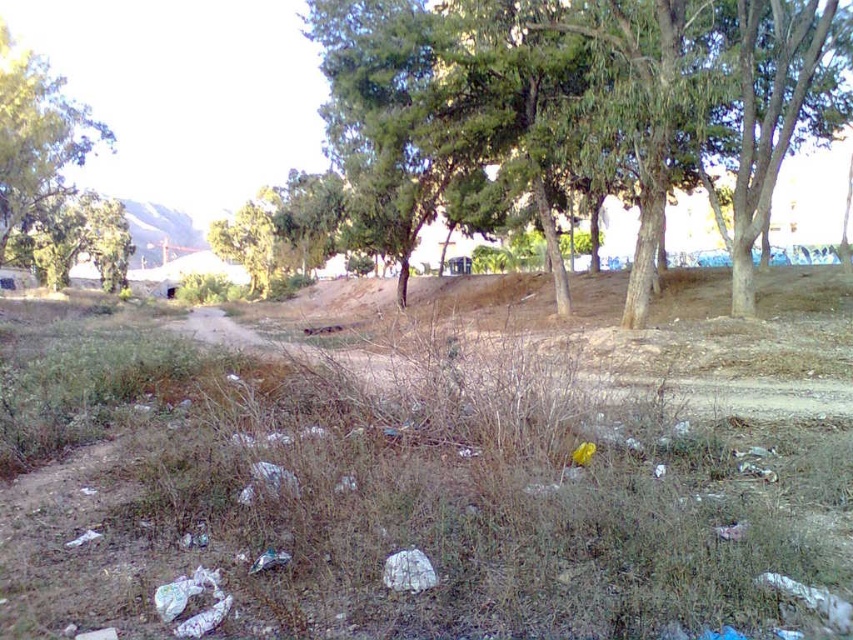
You are planning to set up a picnic area in the park. The picnic area requires a space wider than the green leafy tree at upper left. Can the brown grassy dirt field at center accommodate this requirement?

The brown grassy dirt field at center has a width larger than the green leafy tree at upper left, so yes, the picnic area can be accommodated there.

You are standing at the point with coordinates 0.0, 0.0. You want to walk to the green leafy tree at center. Which direction should you move in?

The green leafy tree at center is located at point (718, 99). Since you are at (0, 0), you should move northeast to reach it.